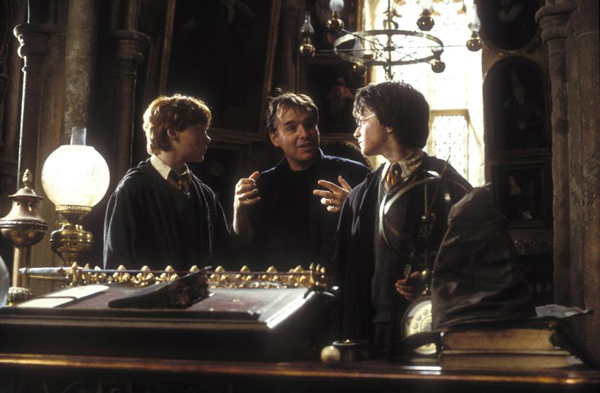
Where is `books`? books is located at coordinates (491, 335), (484, 359).